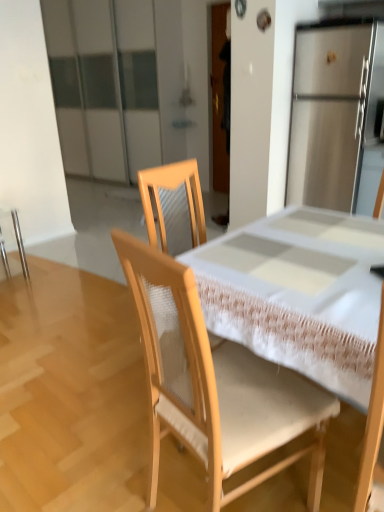
Question: Is metallic silver chair at left, which is the 2th chair in right-to-left order, bigger than wooden chair at center, which is the 1th chair in front-to-back order?

Choices:
 (A) yes
 (B) no

Answer: (B)

Question: Is metallic silver chair at left, the first chair positioned from the back, at the right side of wooden chair at center, the 1th chair viewed from the right?

Choices:
 (A) yes
 (B) no

Answer: (B)

Question: From the image's perspective, is metallic silver chair at left, the first chair positioned from the back, beneath wooden chair at center, the 2th chair viewed from the back?

Choices:
 (A) yes
 (B) no

Answer: (B)

Question: Is metallic silver chair at left, the 1th chair positioned from the left, in front of wooden chair at center, the 1th chair viewed from the right?

Choices:
 (A) yes
 (B) no

Answer: (B)

Question: Is wooden chair at center, which is the 1th chair in front-to-back order, at the back of metallic silver chair at left, the first chair positioned from the back?

Choices:
 (A) yes
 (B) no

Answer: (B)

Question: Can you see metallic silver chair at left, the 1th chair positioned from the left, touching wooden chair at center, the 2th chair viewed from the back?

Choices:
 (A) yes
 (B) no

Answer: (B)

Question: Is wooden chair at center, which is the 1th chair in front-to-back order, next to metallic silver chair at left, the first chair positioned from the back, and touching it?

Choices:
 (A) no
 (B) yes

Answer: (A)

Question: Could you tell me if wooden chair at center, the 1th chair viewed from the right, is turned towards metallic silver chair at left, which is counted as the second chair, starting from the front?

Choices:
 (A) yes
 (B) no

Answer: (B)

Question: Considering the relative sizes of wooden chair at center, the 2th chair viewed from the back, and metallic silver chair at left, which is the 2th chair in right-to-left order, in the image provided, is wooden chair at center, the 2th chair viewed from the back, shorter than metallic silver chair at left, which is the 2th chair in right-to-left order,?

Choices:
 (A) no
 (B) yes

Answer: (A)

Question: From the image's perspective, is wooden chair at center, the 1th chair viewed from the right, under metallic silver chair at left, the 1th chair positioned from the left?

Choices:
 (A) no
 (B) yes

Answer: (B)

Question: Is wooden chair at center, the 1th chair viewed from the right, facing away from metallic silver chair at left, the first chair positioned from the back?

Choices:
 (A) no
 (B) yes

Answer: (A)

Question: Does wooden chair at center, positioned as the 2th chair in left-to-right order, have a smaller size compared to metallic silver chair at left, the first chair positioned from the back?

Choices:
 (A) no
 (B) yes

Answer: (A)

Question: From a real-world perspective, is wooden chair at center, which is the 1th chair in front-to-back order, above or below metallic silver chair at left, which is the 2th chair in right-to-left order?

Choices:
 (A) below
 (B) above

Answer: (B)